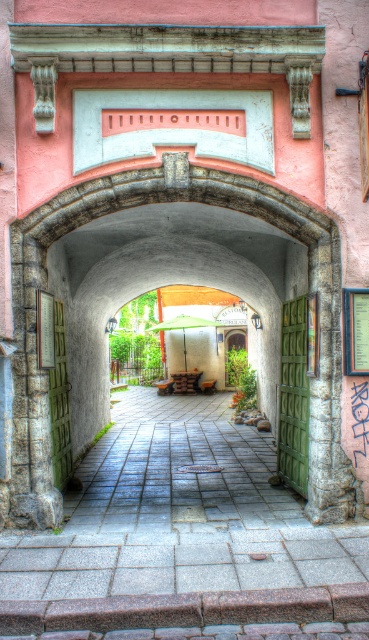
Question: Which object is closer to the camera taking this photo?

Choices:
 (A) green matte door at left
 (B) granite paved path at center
 (C) green wooden door at center

Answer: (B)

Question: Estimate the real-world distances between objects in this image. Which object is farther from the granite paved path at center?

Choices:
 (A) green wooden door at center
 (B) green matte door at left

Answer: (B)

Question: Can you confirm if granite paved path at center is smaller than green wooden door at center?

Choices:
 (A) no
 (B) yes

Answer: (A)

Question: In this image, where is green wooden door at center located relative to green matte door at left?

Choices:
 (A) right
 (B) left

Answer: (A)

Question: Is green wooden door at center to the right of green matte door at left from the viewer's perspective?

Choices:
 (A) no
 (B) yes

Answer: (B)

Question: Which of these objects is positioned closest to the green matte door at left?

Choices:
 (A) green wooden door at center
 (B) granite paved path at center

Answer: (B)